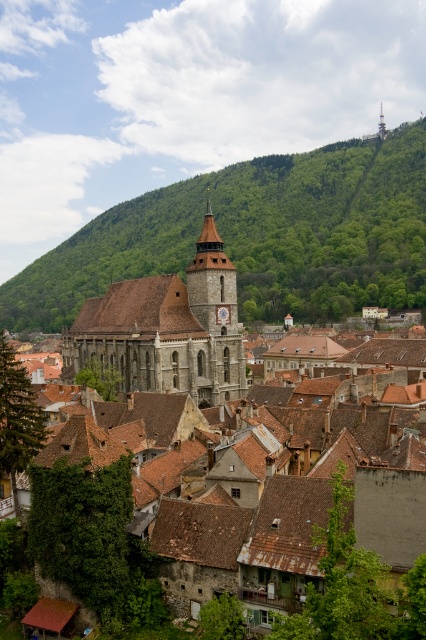
Question: Can you confirm if brown stone church at center is positioned to the right of gray stone clock tower at center?

Choices:
 (A) no
 (B) yes

Answer: (A)

Question: Which point is closer to the camera taking this photo?

Choices:
 (A) (103, 305)
 (B) (5, 310)
 (C) (218, 445)
 (D) (192, 310)

Answer: (C)

Question: Can you confirm if green leafy hillside at upper center is positioned below dark gray stone church at center?

Choices:
 (A) no
 (B) yes

Answer: (A)

Question: Is dark gray stone church at center wider than gray stone clock tower at center?

Choices:
 (A) yes
 (B) no

Answer: (A)

Question: Which point appears farthest from the camera in this image?

Choices:
 (A) (123, 252)
 (B) (210, 577)

Answer: (A)

Question: Which of the following is the closest to the observer?

Choices:
 (A) gray stone clock tower at center
 (B) dark gray stone church at center

Answer: (B)